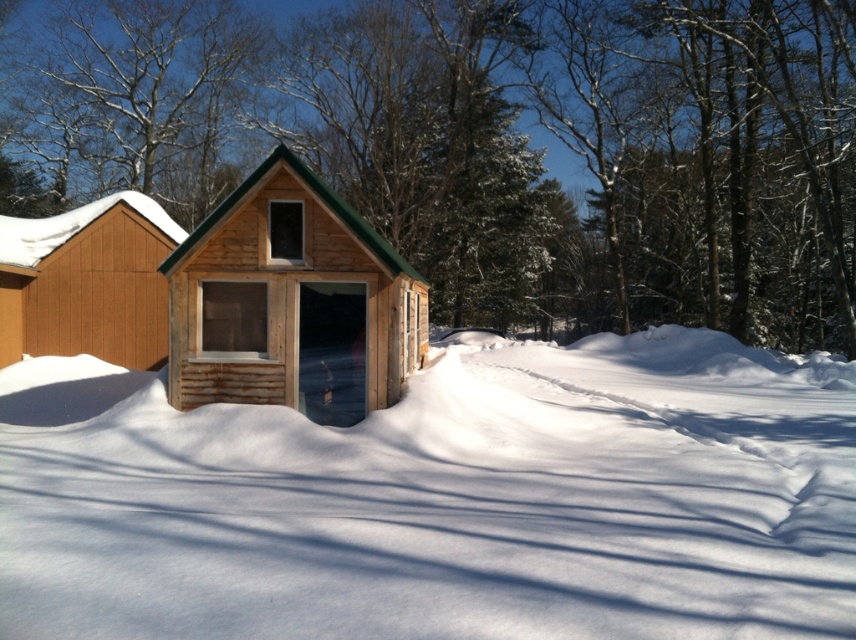
Question: Can you confirm if natural wood cabin at center is positioned above brown wood cabin at left?

Choices:
 (A) yes
 (B) no

Answer: (B)

Question: From the image, what is the correct spatial relationship of natural wood cabin at center in relation to bare branches at upper center?

Choices:
 (A) above
 (B) below

Answer: (B)

Question: Which object is positioned farthest from the bare branches at upper center?

Choices:
 (A) brown wood cabin at left
 (B) white fluffy snow at center
 (C) natural wood cabin at center

Answer: (C)

Question: Which point is farther to the camera?

Choices:
 (A) (94, 301)
 (B) (432, 384)
 (C) (63, 72)
 (D) (197, 332)

Answer: (C)

Question: Which of these objects is positioned farthest from the natural wood cabin at center?

Choices:
 (A) brown wood cabin at left
 (B) bare branches at upper center
 (C) white fluffy snow at center

Answer: (B)

Question: Is bare branches at upper center thinner than brown wood cabin at left?

Choices:
 (A) no
 (B) yes

Answer: (A)